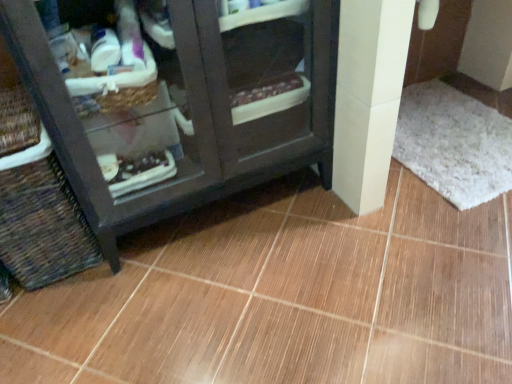
Where is `vacant space situated above brown glossy tile at center (from a real-world perspective)`? This screenshot has width=512, height=384. vacant space situated above brown glossy tile at center (from a real-world perspective) is located at coordinates (336, 235).